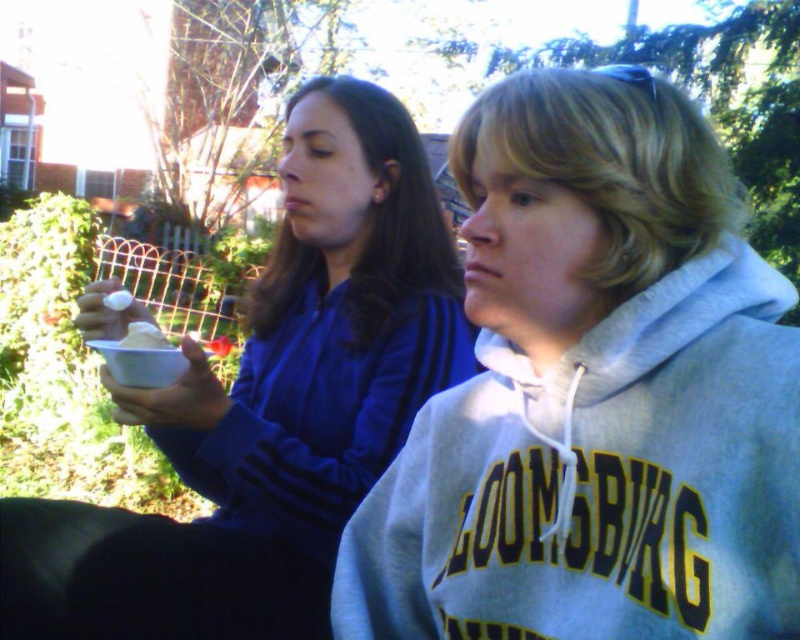
Based on the scene description, where is the matte blue sweatshirt at center located in terms of coordinates?

The matte blue sweatshirt at center is located at coordinates point (270, 406).

You are at a coffee shop and want to place your matte blue sweatshirt at center and white matte cup at center on the table. Which item should you place first to ensure the sweatshirt is to the right of the cup?

Place the white matte cup at center first, then place the matte blue sweatshirt at center to its right so that the sweatshirt ends up to the right of the cup.

You are trying to decide which sweatshirt to wear today. You see both the gray fleece sweatshirt at center and the matte blue sweatshirt at center in the image. Which one is positioned lower on the person?

The gray fleece sweatshirt at center is positioned lower because it is below the matte blue sweatshirt at center.